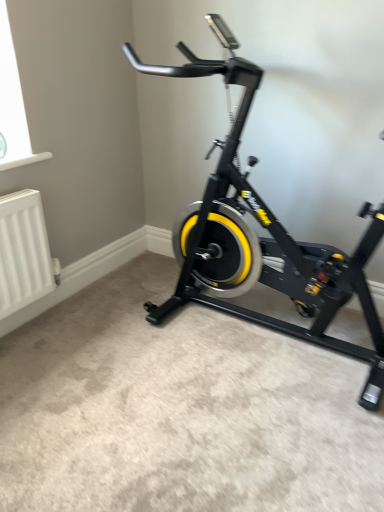
This screenshot has width=384, height=512. I want to click on vacant region below black matte stationary bicycle at center (from a real-world perspective), so click(x=264, y=330).